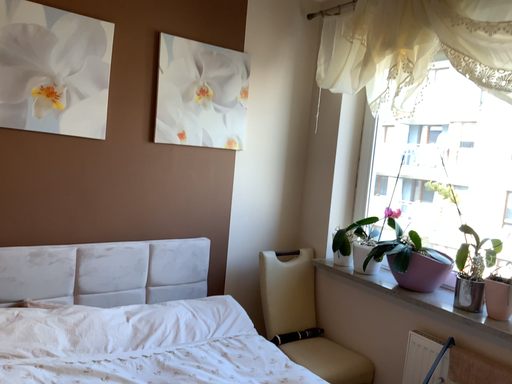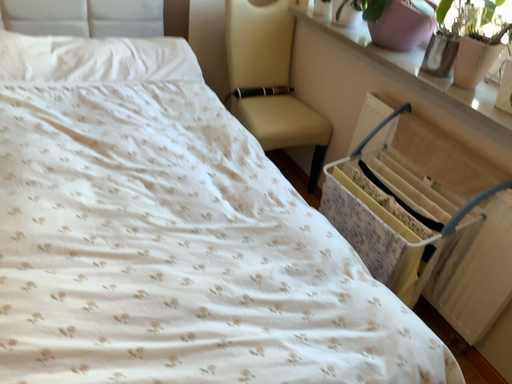
Question: Which way did the camera rotate in the video?

Choices:
 (A) rotated right
 (B) rotated left

Answer: (B)